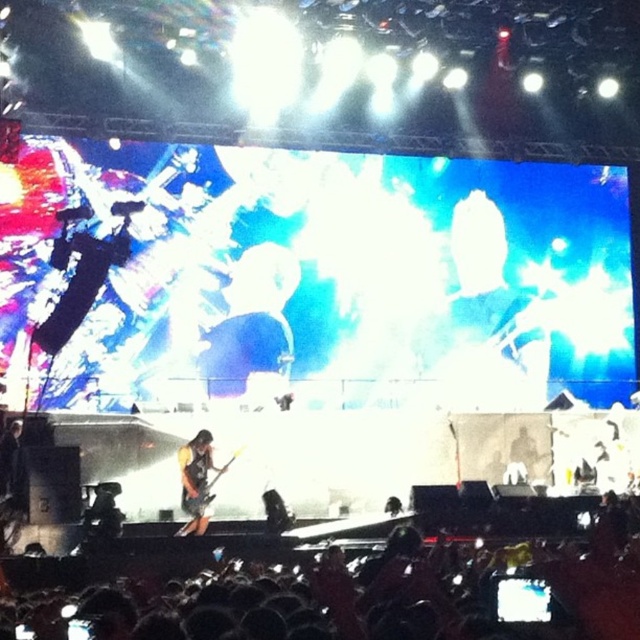
Question: Is black fabric crowd at lower center behind orange fabric guitar at center?

Choices:
 (A) no
 (B) yes

Answer: (A)

Question: Does black fabric crowd at lower center lie in front of orange fabric guitar at center?

Choices:
 (A) yes
 (B) no

Answer: (A)

Question: Is black fabric crowd at lower center wider than orange fabric guitar at center?

Choices:
 (A) no
 (B) yes

Answer: (B)

Question: Which object appears closest to the camera in this image?

Choices:
 (A) orange fabric guitar at center
 (B) black fabric crowd at lower center

Answer: (B)